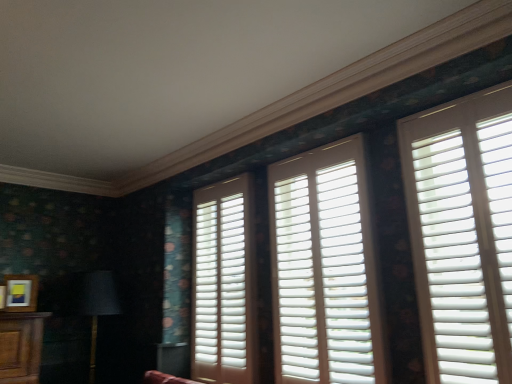
Locate an element on the screen. The image size is (512, 384). matte wooden picture frame at lower left is located at coordinates (21, 293).

How much space does white matte shutters at right, arranged as the third window when viewed from the left, occupy vertically?

white matte shutters at right, arranged as the third window when viewed from the left, is 4.01 feet in height.

Where is `white matte wood shutters at center, which is the second window in left-to-right order`? The width and height of the screenshot is (512, 384). white matte wood shutters at center, which is the second window in left-to-right order is located at coordinates (324, 268).

This screenshot has width=512, height=384. Find the location of `window that is the 1st one above the matte wooden picture frame at lower left (from a real-world perspective)`. window that is the 1st one above the matte wooden picture frame at lower left (from a real-world perspective) is located at coordinates (224, 284).

Considering the sizes of objects white wood blinds at center, arranged as the first window when viewed from the left, and matte wooden picture frame at lower left in the image provided, who is bigger, white wood blinds at center, arranged as the first window when viewed from the left, or matte wooden picture frame at lower left?

With larger size is white wood blinds at center, arranged as the first window when viewed from the left.

Is white wood blinds at center, arranged as the first window when viewed from the left, touching matte wooden picture frame at lower left?

No.

Based on the photo, would you say white matte shutters at right, acting as the first window starting from the right, is part of matte black lampshade at left's contents?

No, matte black lampshade at left does not contain white matte shutters at right, acting as the first window starting from the right.

From the picture: Which point is more distant from viewer, (93, 342) or (404, 163)?

The point (93, 342) is farther from the camera.

Measure the distance from matte black lampshade at left to white matte shutters at right, acting as the first window starting from the right.

matte black lampshade at left and white matte shutters at right, acting as the first window starting from the right, are 7.69 feet apart from each other.

Who is shorter, matte black lampshade at left or white matte shutters at right, arranged as the third window when viewed from the left?

matte black lampshade at left.

Looking at this image, from the image's perspective, would you say matte wooden picture frame at lower left is positioned over matte black lampshade at left?

Indeed, from the image's perspective, matte wooden picture frame at lower left is shown above matte black lampshade at left.

Is matte wooden picture frame at lower left thinner than matte black lampshade at left?

Yes, matte wooden picture frame at lower left is thinner than matte black lampshade at left.

Which of these two, matte wooden picture frame at lower left or matte black lampshade at left, is bigger?

With larger size is matte black lampshade at left.

How different are the orientations of white matte shutters at right, acting as the first window starting from the right, and matte black lampshade at left in degrees?

They differ by 88.6 degrees in their facing directions.

Between white matte shutters at right, arranged as the third window when viewed from the left, and matte black lampshade at left, which one is positioned in front?

white matte shutters at right, arranged as the third window when viewed from the left, is more forward.

Consider the image. Is white matte shutters at right, arranged as the third window when viewed from the left, surrounding matte black lampshade at left?

Definitely not — matte black lampshade at left is not inside white matte shutters at right, arranged as the third window when viewed from the left.

Looking at this image, is white matte shutters at right, acting as the first window starting from the right, facing away from matte black lampshade at left?

No.

How different are the orientations of matte wooden picture frame at lower left and white matte shutters at right, arranged as the third window when viewed from the left, in degrees?

matte wooden picture frame at lower left and white matte shutters at right, arranged as the third window when viewed from the left, are facing 74.5 degrees away from each other.

Would you say matte wooden picture frame at lower left is a long distance from white matte shutters at right, arranged as the third window when viewed from the left?

Yes.

Which is in front, matte wooden picture frame at lower left or white matte shutters at right, acting as the first window starting from the right?

white matte shutters at right, acting as the first window starting from the right.

Can you confirm if matte wooden picture frame at lower left is thinner than white matte shutters at right, acting as the first window starting from the right?

In fact, matte wooden picture frame at lower left might be wider than white matte shutters at right, acting as the first window starting from the right.

Which object is wider, white wood blinds at center, arranged as the first window when viewed from the left, or white matte shutters at right, acting as the first window starting from the right?

Wider between the two is white matte shutters at right, acting as the first window starting from the right.

Is white matte shutters at right, arranged as the third window when viewed from the left, at the back of white wood blinds at center, the 3th window when ordered from right to left?

No.

At what (x,y) coordinates should I click in order to perform the action: click on the 2nd window behind the white matte shutters at right, acting as the first window starting from the right, starting your count from the anchor. Please return your answer as a coordinate pair (x, y). The height and width of the screenshot is (384, 512). Looking at the image, I should click on (224, 284).

Is point (214, 323) closer or farther from the camera than point (508, 86)?

Point (214, 323) appears to be farther away from the viewer than point (508, 86).

Is white matte shutters at right, arranged as the third window when viewed from the left, oriented towards matte wooden picture frame at lower left?

No, white matte shutters at right, arranged as the third window when viewed from the left, is not oriented towards matte wooden picture frame at lower left.

From the image's perspective, is white matte shutters at right, arranged as the third window when viewed from the left, over matte wooden picture frame at lower left?

Yes, from the image's perspective, white matte shutters at right, arranged as the third window when viewed from the left, is over matte wooden picture frame at lower left.

Which is behind, white matte shutters at right, acting as the first window starting from the right, or matte wooden picture frame at lower left?

matte wooden picture frame at lower left.

Find the location of a particular element. The image size is (512, 384). picture frame that appears below the white wood blinds at center, arranged as the first window when viewed from the left (from the image's perspective) is located at coordinates (21, 293).

You are a GUI agent. You are given a task and a screenshot of the screen. Output one action in this format:
    pyautogui.click(x=<x>, y=<y>)
    Task: Click on the 3rd window to the right of the matte black lampshade at left, starting your count from the anchor
    
    Given the screenshot: What is the action you would take?
    pyautogui.click(x=462, y=234)

Which object lies further to the anchor point white matte wood shutters at center, which is the second window in left-to-right order, matte black lampshade at left or matte wooden picture frame at lower left?

matte wooden picture frame at lower left is positioned further to the anchor white matte wood shutters at center, which is the second window in left-to-right order.

When comparing their distances from white matte wood shutters at center, which is the second window in left-to-right order, does white matte shutters at right, arranged as the third window when viewed from the left, or white wood blinds at center, arranged as the first window when viewed from the left, seem closer?

The object closer to white matte wood shutters at center, which is the second window in left-to-right order, is white matte shutters at right, arranged as the third window when viewed from the left.

When comparing their distances from white wood blinds at center, the 3th window when ordered from right to left, does matte wooden picture frame at lower left or white matte wood shutters at center, acting as the 2th window starting from the right, seem closer?

white matte wood shutters at center, acting as the 2th window starting from the right.

Estimate the real-world distances between objects in this image. Which object is further from white matte shutters at right, acting as the first window starting from the right, white matte wood shutters at center, which is the second window in left-to-right order, or white wood blinds at center, the 3th window when ordered from right to left?

white wood blinds at center, the 3th window when ordered from right to left, is further to white matte shutters at right, acting as the first window starting from the right.

In the scene shown: Which object lies nearer to the anchor point matte black lampshade at left, white matte wood shutters at center, which is the second window in left-to-right order, or matte wooden picture frame at lower left?

matte wooden picture frame at lower left lies closer to matte black lampshade at left than the other object.

In the scene shown: When comparing their distances from white matte wood shutters at center, acting as the 2th window starting from the right, does white wood blinds at center, arranged as the first window when viewed from the left, or white matte shutters at right, arranged as the third window when viewed from the left, seem closer?

Among the two, white matte shutters at right, arranged as the third window when viewed from the left, is located nearer to white matte wood shutters at center, acting as the 2th window starting from the right.

Based on their spatial positions, is matte black lampshade at left or white wood blinds at center, the 3th window when ordered from right to left, further from white matte wood shutters at center, which is the second window in left-to-right order?

matte black lampshade at left is positioned further to the anchor white matte wood shutters at center, which is the second window in left-to-right order.

Considering their positions, is white wood blinds at center, the 3th window when ordered from right to left, positioned further to white matte shutters at right, arranged as the third window when viewed from the left, than white matte wood shutters at center, acting as the 2th window starting from the right?

white wood blinds at center, the 3th window when ordered from right to left.

Locate an element on the screen. The width and height of the screenshot is (512, 384). window between white wood blinds at center, the 3th window when ordered from right to left, and white matte shutters at right, acting as the first window starting from the right is located at coordinates (324, 268).

The image size is (512, 384). In order to click on window located between matte black lampshade at left and white matte wood shutters at center, which is the second window in left-to-right order, in the left-right direction in this screenshot , I will do (x=224, y=284).

Image resolution: width=512 pixels, height=384 pixels. Find the location of `table lamp between matte wooden picture frame at lower left and white matte shutters at right, arranged as the third window when viewed from the left, in the horizontal direction`. table lamp between matte wooden picture frame at lower left and white matte shutters at right, arranged as the third window when viewed from the left, in the horizontal direction is located at coordinates (95, 304).

Where is `table lamp between matte wooden picture frame at lower left and white matte wood shutters at center, acting as the 2th window starting from the right, in the horizontal direction`? Image resolution: width=512 pixels, height=384 pixels. table lamp between matte wooden picture frame at lower left and white matte wood shutters at center, acting as the 2th window starting from the right, in the horizontal direction is located at coordinates (95, 304).